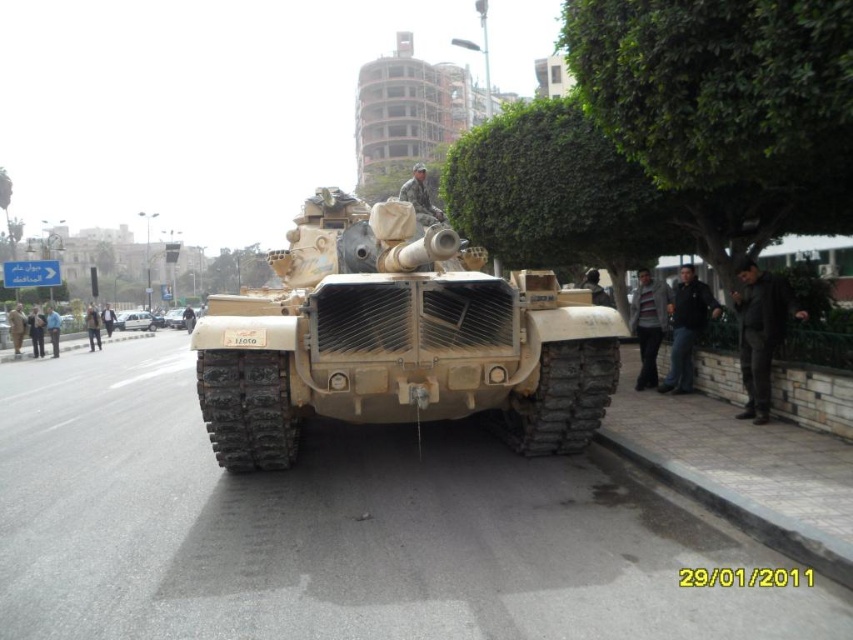
Question: Which object is closer to the camera taking this photo?

Choices:
 (A) camouflage textured tank at center
 (B) camouflage fabric tank at center

Answer: (A)

Question: Which object is closer to the camera taking this photo?

Choices:
 (A) camouflage fabric tank at center
 (B) camouflage textured tank at center

Answer: (B)

Question: Is camouflage textured tank at center thinner than camouflage fabric tank at center?

Choices:
 (A) yes
 (B) no

Answer: (A)

Question: Observing the image, what is the correct spatial positioning of camouflage textured tank at center in reference to camouflage fabric tank at center?

Choices:
 (A) above
 (B) below

Answer: (B)

Question: Which of the following is the farthest from the observer?

Choices:
 (A) (229, 465)
 (B) (132, 320)

Answer: (B)

Question: Does camouflage textured tank at center have a larger size compared to camouflage fabric tank at center?

Choices:
 (A) yes
 (B) no

Answer: (B)